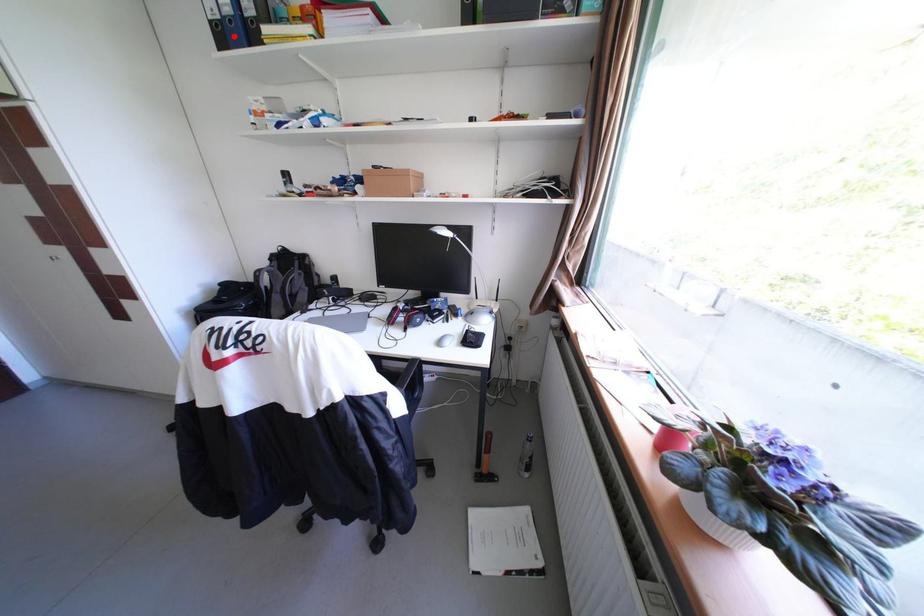
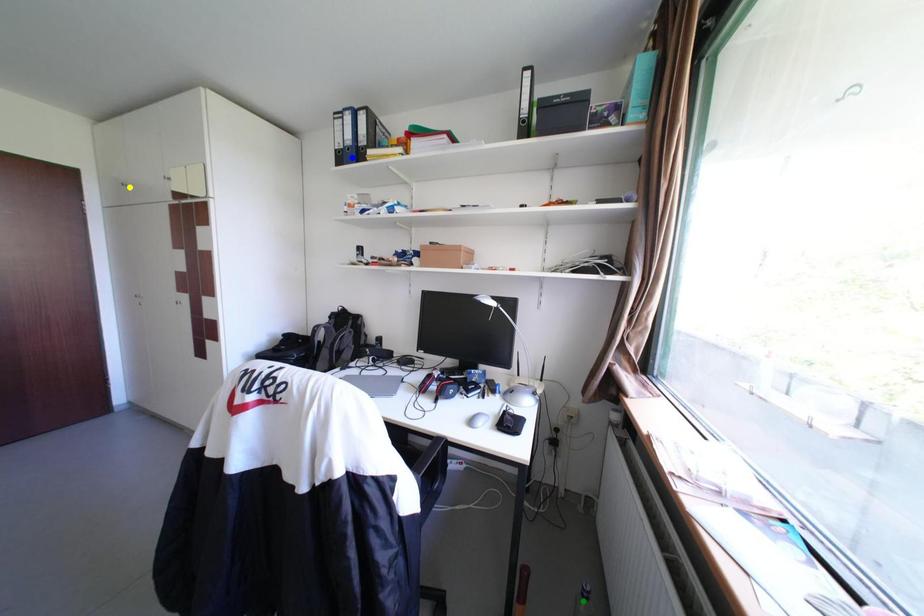
Question: I am providing you with two images of the same scene from different viewpoints. A red point is marked on the first image. You are given multiple points on the second image. Which spot in image 2 lines up with the point in image 1?

Choices:
 (A) green point
 (B) blue point
 (C) yellow point

Answer: (B)